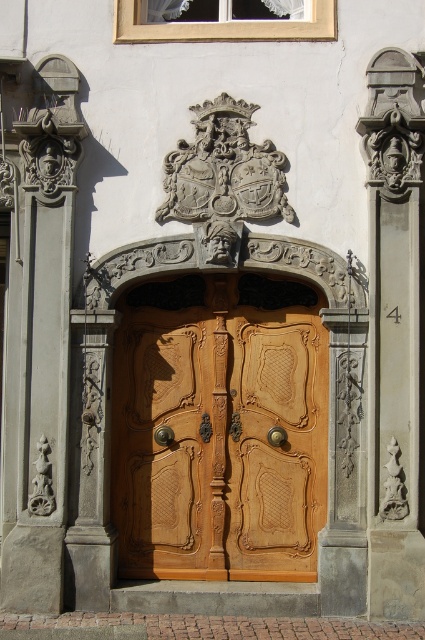
Question: Which object is closer to the camera taking this photo?

Choices:
 (A) wooden carved door at center
 (B) stone carving at right

Answer: (B)

Question: Which point appears farthest from the camera in this image?

Choices:
 (A) (316, 406)
 (B) (396, 176)

Answer: (A)

Question: Is wooden carved door at center wider than stone carving at right?

Choices:
 (A) no
 (B) yes

Answer: (B)

Question: Does wooden carved door at center have a lesser width compared to stone carving at right?

Choices:
 (A) yes
 (B) no

Answer: (B)

Question: Which of the following is the farthest from the observer?

Choices:
 (A) (402, 586)
 (B) (198, 548)

Answer: (B)

Question: Can you confirm if wooden carved door at center is positioned to the left of stone carving at right?

Choices:
 (A) no
 (B) yes

Answer: (B)